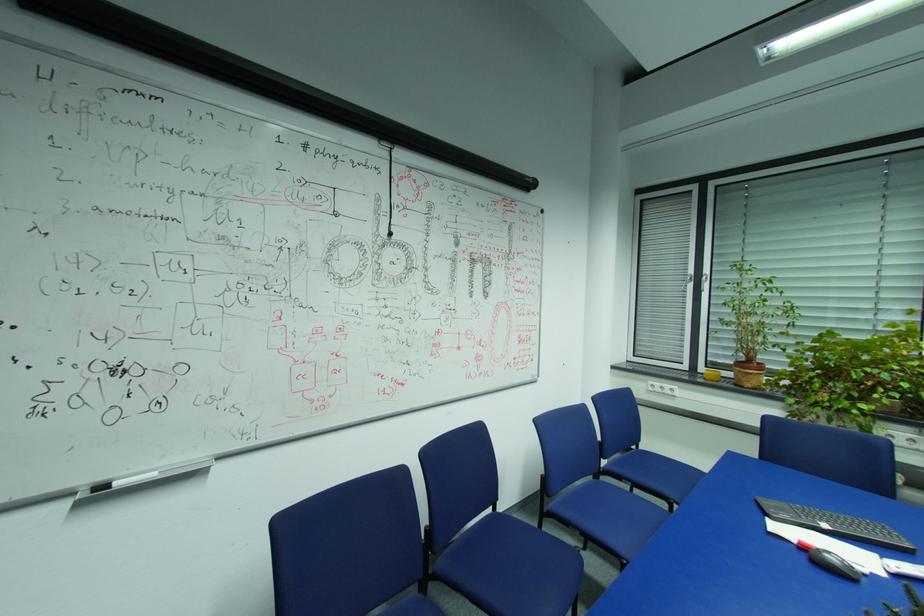
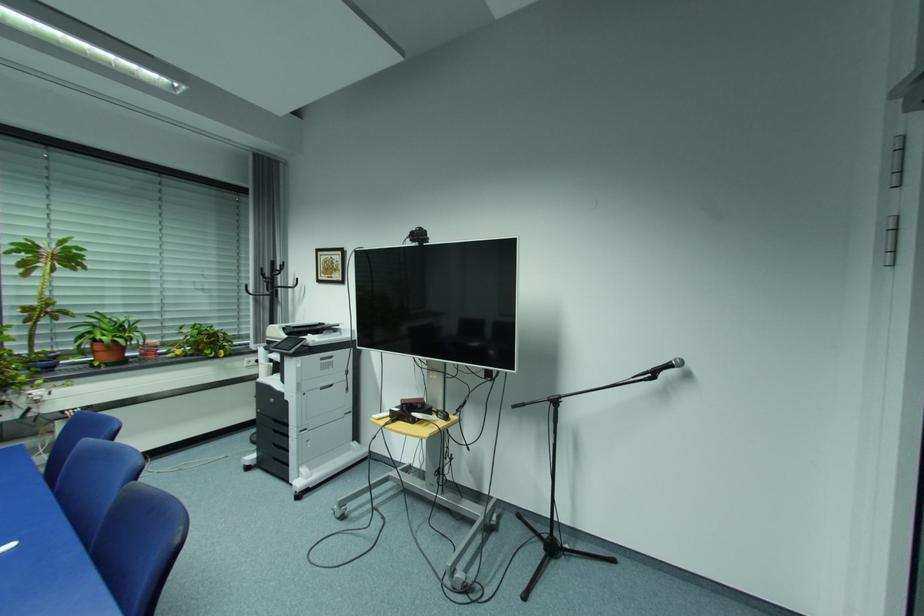
Question: The first image is from the beginning of the video and the second image is from the end. How did the camera likely rotate when shooting the video?

Choices:
 (A) Left
 (B) Right
 (C) Up
 (D) Down

Answer: (B)